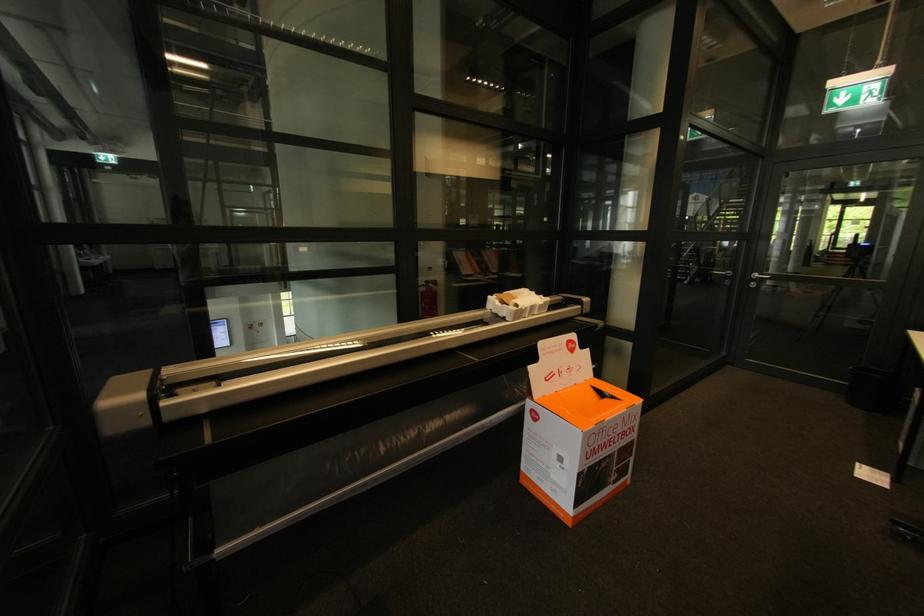
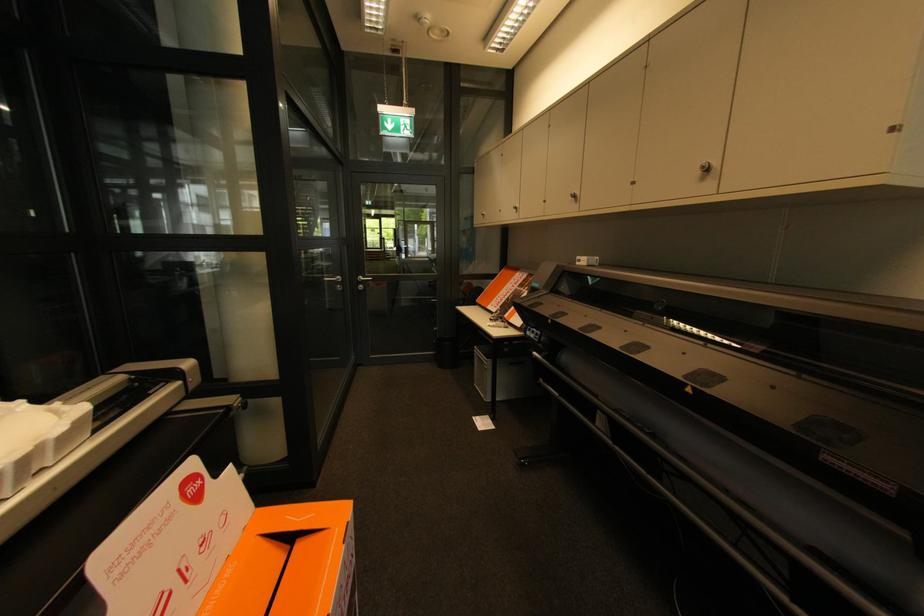
Find the pixel in the second image that matches the point at 852,384 in the first image.

(439, 354)